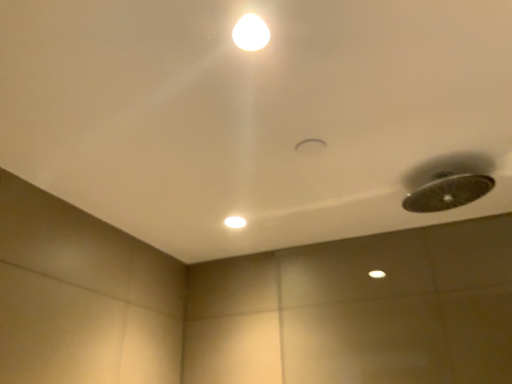
Measure the distance between point (240, 18) and camera.

The distance of point (240, 18) from camera is 31.38 inches.

Identify the location of white glossy light at upper center. (251, 33).

The width and height of the screenshot is (512, 384). What do you see at coordinates (251, 33) in the screenshot? I see `white glossy light at upper center` at bounding box center [251, 33].

The width and height of the screenshot is (512, 384). Describe the element at coordinates (234, 222) in the screenshot. I see `matte white light at center` at that location.

Locate an element on the screen. Image resolution: width=512 pixels, height=384 pixels. matte white light at center is located at coordinates (234, 222).

The width and height of the screenshot is (512, 384). What are the coordinates of `white glossy light at upper center` in the screenshot? It's located at (251, 33).

Which object is positioned more to the left, matte white light at center or white glossy light at upper center?

matte white light at center.

From the picture: Considering the positions of objects matte white light at center and white glossy light at upper center in the image provided, who is in front, matte white light at center or white glossy light at upper center?

white glossy light at upper center is more forward.

Between point (231, 220) and point (249, 36), which one is positioned in front?

The point (249, 36) is more forward.

From the image's perspective, which one is positioned lower, matte white light at center or white glossy light at upper center?

matte white light at center, from the image's perspective.

From a real-world perspective, is matte white light at center on white glossy light at upper center?

Incorrect, from a real-world perspective, matte white light at center is lower than white glossy light at upper center.

From the picture: Looking at their sizes, would you say matte white light at center is wider or thinner than white glossy light at upper center?

In the image, matte white light at center appears to be wider than white glossy light at upper center.

Considering the sizes of objects matte white light at center and white glossy light at upper center in the image provided, who is taller, matte white light at center or white glossy light at upper center?

matte white light at center is taller.

Considering the relative sizes of matte white light at center and white glossy light at upper center in the image provided, is matte white light at center bigger than white glossy light at upper center?

Correct, matte white light at center is larger in size than white glossy light at upper center.

Is matte white light at center outside of white glossy light at upper center?

matte white light at center is positioned outside white glossy light at upper center.

Is matte white light at center touching white glossy light at upper center?

No, matte white light at center is not making contact with white glossy light at upper center.

Is matte white light at center aimed at white glossy light at upper center?

Yes, matte white light at center is facing white glossy light at upper center.

At what (x,y) coordinates should I click in order to perform the action: click on dot beneath the white glossy light at upper center (from a real-world perspective). Please return your answer as a coordinate pair (x, y). Looking at the image, I should click on (234, 222).

Does white glossy light at upper center appear on the left side of matte white light at center?

No, white glossy light at upper center is not to the left of matte white light at center.

Which object is further away from the camera taking this photo, white glossy light at upper center or matte white light at center?

matte white light at center is behind.

Does point (264, 45) lie behind point (241, 223)?

No, (264, 45) is closer to viewer.

From the image's perspective, would you say white glossy light at upper center is shown under matte white light at center?

No, from the image's perspective, white glossy light at upper center is not below matte white light at center.

From a real-world perspective, does white glossy light at upper center stand above matte white light at center?

Indeed, from a real-world perspective, white glossy light at upper center stands above matte white light at center.

Between white glossy light at upper center and matte white light at center, which one has larger width?

With larger width is matte white light at center.

Considering the relative sizes of white glossy light at upper center and matte white light at center in the image provided, is white glossy light at upper center taller than matte white light at center?

In fact, white glossy light at upper center may be shorter than matte white light at center.

Does white glossy light at upper center have a smaller size compared to matte white light at center?

Yes, white glossy light at upper center is smaller than matte white light at center.

Can matte white light at center be found inside white glossy light at upper center?

Definitely not — matte white light at center is not inside white glossy light at upper center.

Are white glossy light at upper center and matte white light at center far apart?

That's not correct — white glossy light at upper center is a little close to matte white light at center.

Is white glossy light at upper center facing away from matte white light at center?

Yes, white glossy light at upper center's orientation is away from matte white light at center.

How different are the orientations of white glossy light at upper center and matte white light at center in degrees?

The facing directions of white glossy light at upper center and matte white light at center are 0.553 degrees apart.

The width and height of the screenshot is (512, 384). Identify the location of dot below the white glossy light at upper center (from a real-world perspective). click(234, 222).

Identify the location of dot behind the white glossy light at upper center. The width and height of the screenshot is (512, 384). (234, 222).

The width and height of the screenshot is (512, 384). I want to click on lamp to the right of matte white light at center, so click(251, 33).